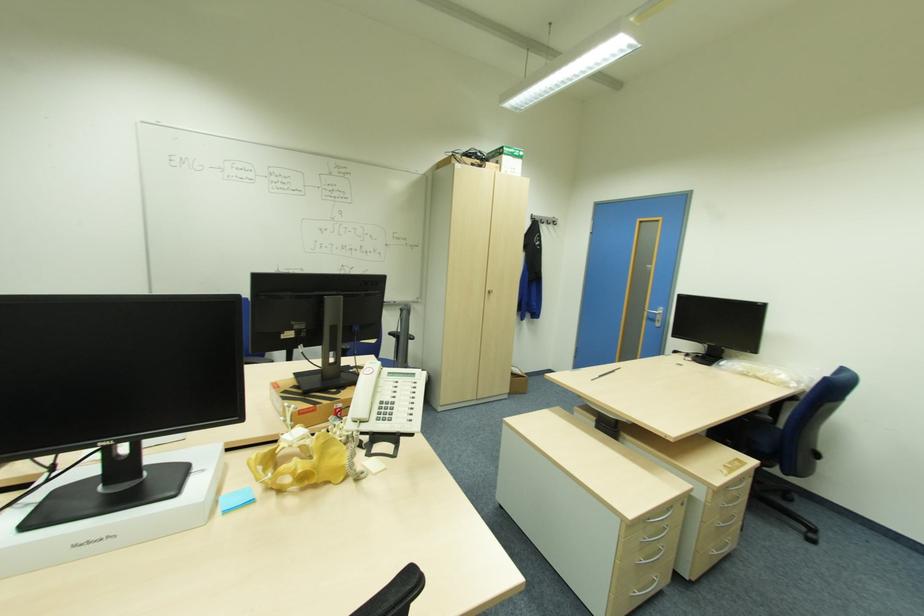
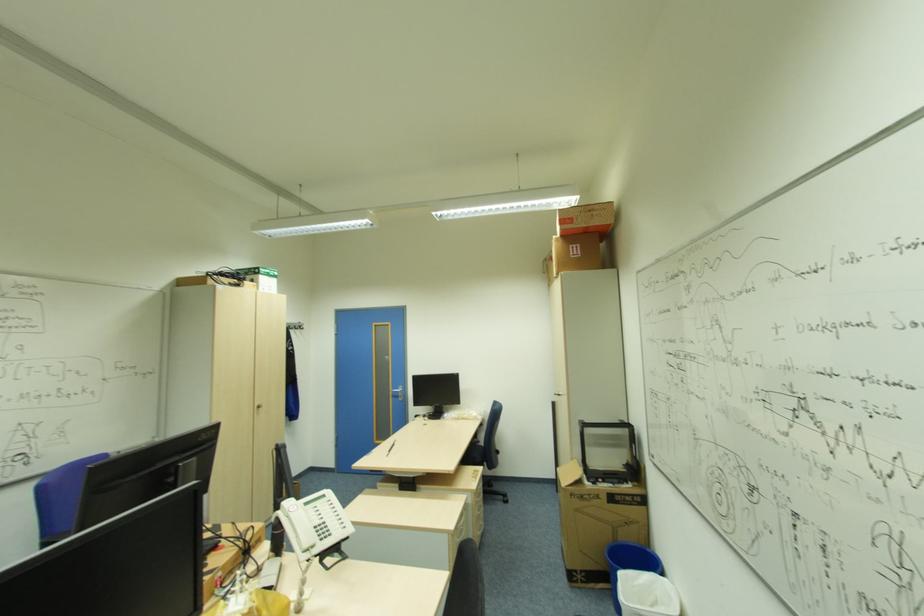
Question: Based on the continuous images, in which direction is the camera rotating? Reply with the corresponding letter.

Choices:
 (A) Left
 (B) Right
 (C) Up
 (D) Down

Answer: (B)